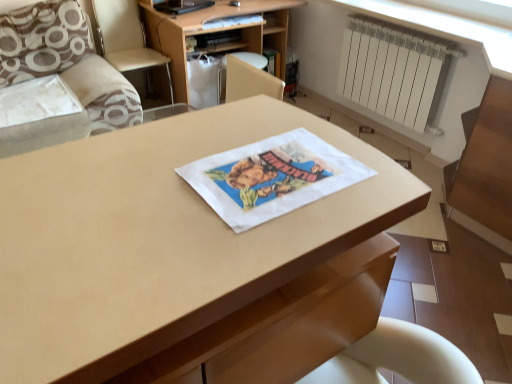
Question: Would you say brown textured pillow at upper left is to the left or to the right of wooden at upper center in the picture?

Choices:
 (A) right
 (B) left

Answer: (B)

Question: Based on their sizes in the image, would you say brown textured pillow at upper left is bigger or smaller than wooden at upper center?

Choices:
 (A) small
 (B) big

Answer: (A)

Question: Which of these objects is positioned closest to the wooden drawer at lower center?

Choices:
 (A) wooden at upper center
 (B) beige fabric armchair at left
 (C) white matte radiator at upper right
 (D) matte wood desk at center
 (E) brown textured pillow at upper left

Answer: (D)

Question: Based on their relative distances, which object is farther from the wooden at upper center?

Choices:
 (A) white matte radiator at upper right
 (B) wooden drawer at lower center
 (C) beige fabric armchair at left
 (D) brown fabric couch at upper left
 (E) matte wood desk at center

Answer: (B)